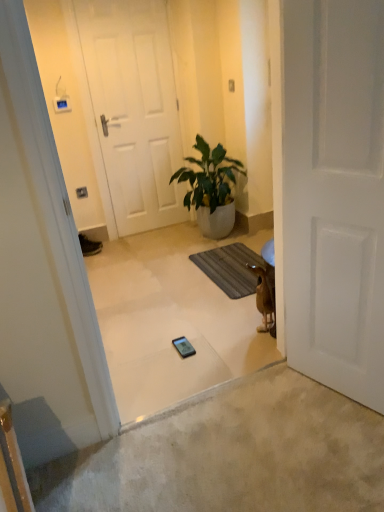
Locate an element on the screen. The height and width of the screenshot is (512, 384). vacant space positioned to the left of white matte door at right, which appears as the 1th door when viewed from the right is located at coordinates (283, 406).